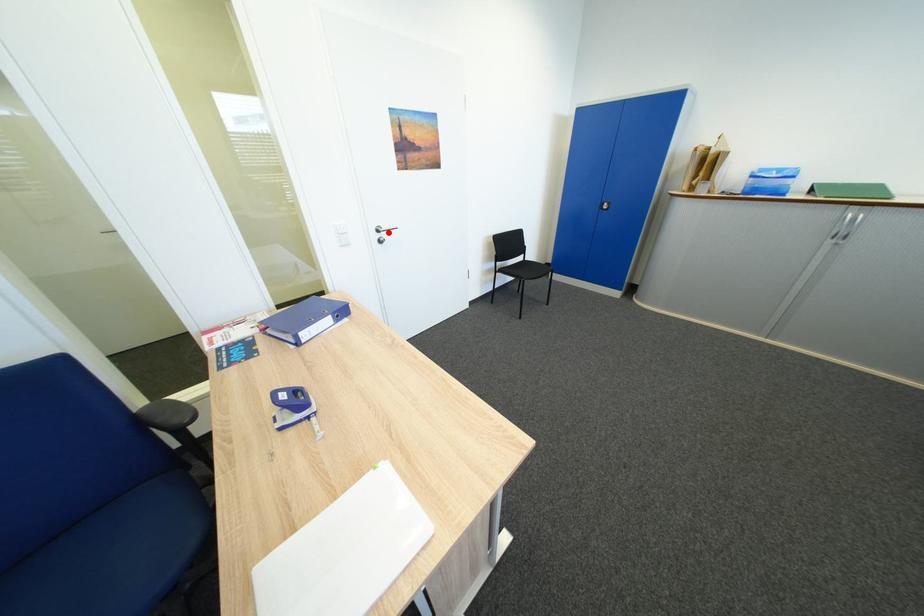
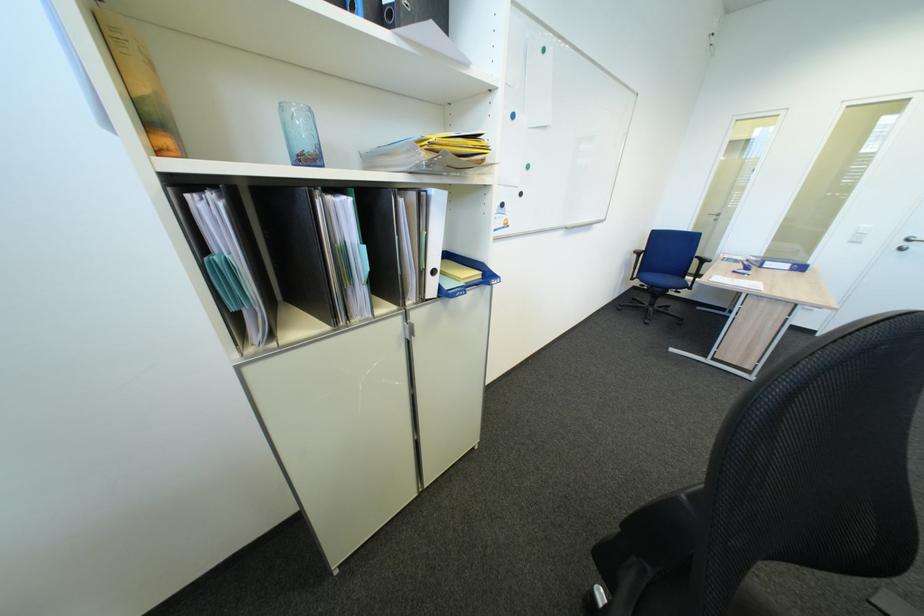
Where in the second image is the point corresponding to the highlighted location from the first image?

(918, 241)